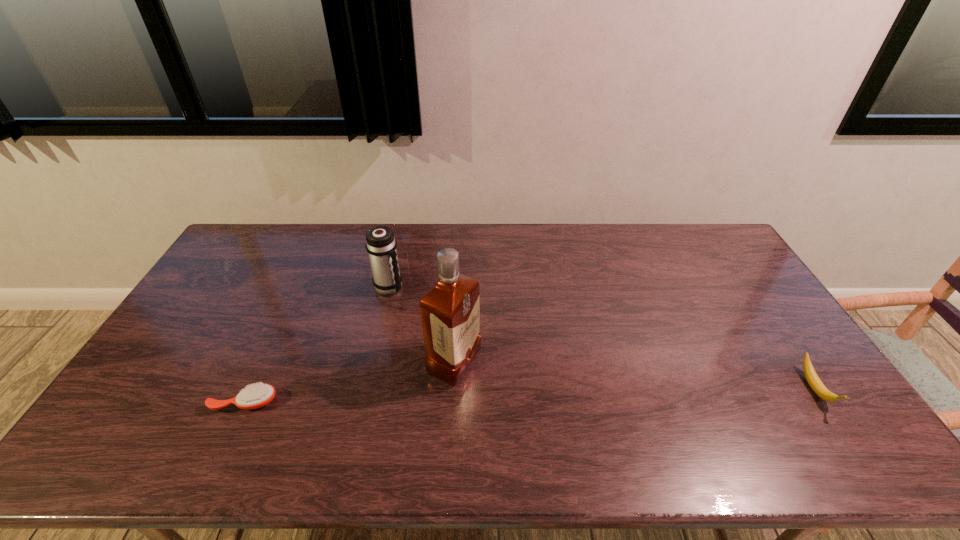
You are a GUI agent. You are given a task and a screenshot of the screen. Output one action in this format:
    pyautogui.click(x=<x>, y=<y>)
    Task: Click on the vacant space at the near edge of the desktop
    This screenshot has height=540, width=960.
    Given the screenshot: What is the action you would take?
    pyautogui.click(x=734, y=419)

Locate an element on the screen. The height and width of the screenshot is (540, 960). vacant area at the left edge of the desktop is located at coordinates (223, 326).

You are a GUI agent. You are given a task and a screenshot of the screen. Output one action in this format:
    pyautogui.click(x=<x>, y=<y>)
    Task: Click on the free space at the right edge
    The width and height of the screenshot is (960, 540).
    Given the screenshot: What is the action you would take?
    pyautogui.click(x=782, y=325)

I want to click on free space at the far right corner of the desktop, so click(715, 254).

The image size is (960, 540). Find the location of `empty space between the second object from right to left and the shortest object`. empty space between the second object from right to left and the shortest object is located at coordinates [x=349, y=383].

Locate an element on the screen. This screenshot has height=540, width=960. free spot between the hairbrush and the second object from left to right is located at coordinates click(317, 345).

Where is `free space between the second object from right to left and the farthest object`? This screenshot has width=960, height=540. free space between the second object from right to left and the farthest object is located at coordinates (421, 326).

The image size is (960, 540). I want to click on free space between the banana and the hairbrush, so click(530, 395).

This screenshot has height=540, width=960. Find the location of `unoccupied area between the second tallest object and the second shortest object`. unoccupied area between the second tallest object and the second shortest object is located at coordinates (602, 338).

In order to click on blank region between the third object from right to left and the second object from right to left in this screenshot , I will do `click(421, 326)`.